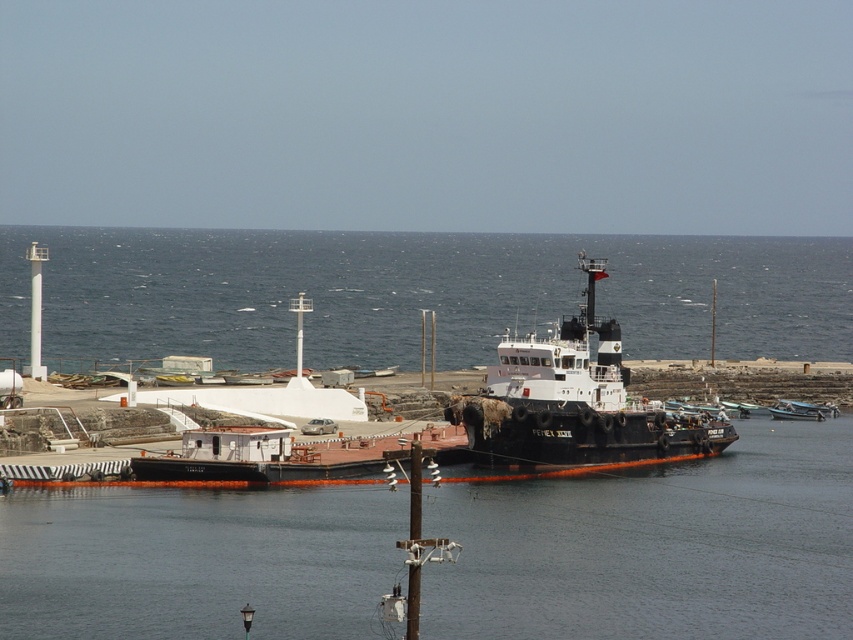
Is point (444, 413) more distant than point (225, 397)?

No, it is not.

Who is more distant from viewer, (670, 438) or (352, 396)?

Point (352, 396)

Measure the distance between point (520, 381) and camera.

Point (520, 381) is 350.44 feet from camera.

You are a GUI agent. You are given a task and a screenshot of the screen. Output one action in this format:
    pyautogui.click(x=<x>, y=<y>)
    Task: Click on the black rubber boat at center
    This screenshot has height=640, width=853.
    Given the screenshot: What is the action you would take?
    pyautogui.click(x=573, y=403)

Which is in front, point (741, 348) or point (573, 406)?

Positioned in front is point (573, 406).

Who is more distant from viewer, (93, 296) or (554, 349)?

The point (93, 296) is behind.

Is point (219, 330) more distant than point (538, 436)?

Yes, it is behind point (538, 436).

Identify the location of blue water at center. (416, 292).

Is blue water at center thinner than white matte boat at center?

No.

Is blue water at center in front of white matte boat at center?

Yes.

Is point (235, 276) behind point (236, 403)?

Yes, it is.

The height and width of the screenshot is (640, 853). I want to click on blue water at center, so click(x=416, y=292).